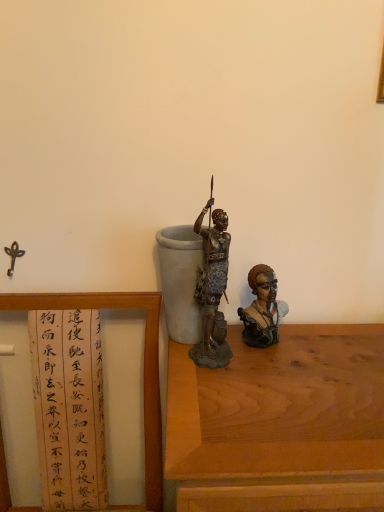
Question: From the image's perspective, is wooden framed paper at left above or below wooden table at center?

Choices:
 (A) below
 (B) above

Answer: (B)

Question: From a real-world perspective, relative to wooden table at center, is wooden framed paper at left vertically above or below?

Choices:
 (A) above
 (B) below

Answer: (A)

Question: Which is farther from the wooden table at center?

Choices:
 (A) bronze statue at center, the first person in the left-to-right sequence
 (B) wooden framed paper at left
 (C) matte brown bust at right, marked as the 2th person in a left-to-right arrangement

Answer: (B)

Question: Which object is the closest to the bronze statue at center, the second person when ordered from right to left?

Choices:
 (A) wooden framed paper at left
 (B) wooden table at center
 (C) matte brown bust at right, which is counted as the 1th person, starting from the right

Answer: (C)